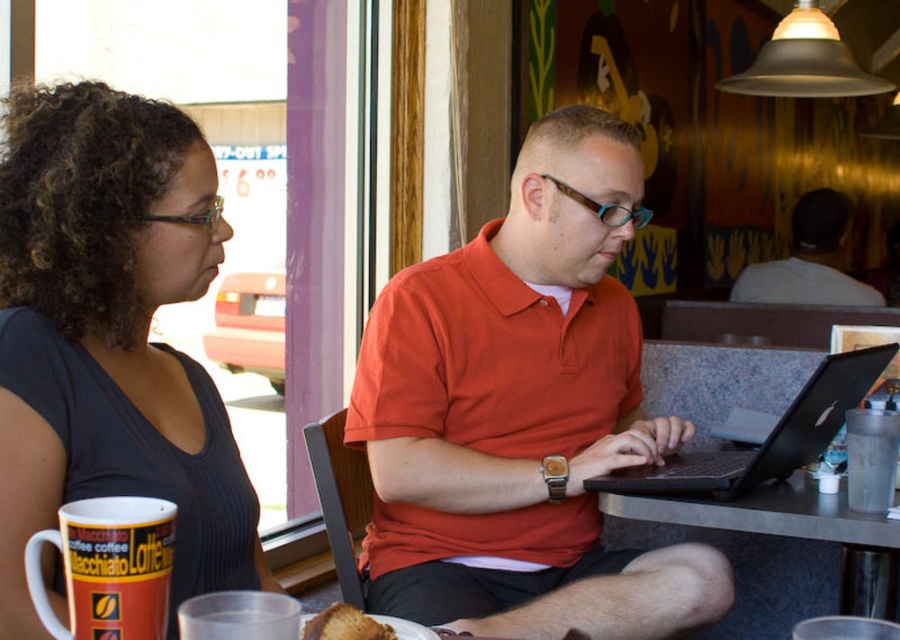
Is black matte laptop at center further to camera compared to white matte shirt at upper right?

No.

Is black matte laptop at center above white matte shirt at upper right?

No.

Which is in front, point (824, 365) or point (731, 292)?

Positioned in front is point (824, 365).

This screenshot has height=640, width=900. I want to click on black matte laptop at center, so click(x=765, y=436).

What do you see at coordinates (111, 333) in the screenshot? I see `dark gray ribbed shirt at left` at bounding box center [111, 333].

Does dark gray ribbed shirt at left come in front of golden brown crumbly pastry at lower center?

No.

Locate an element on the screen. dark gray ribbed shirt at left is located at coordinates (111, 333).

Find the location of `dark gray ribbed shirt at left`. dark gray ribbed shirt at left is located at coordinates (111, 333).

The height and width of the screenshot is (640, 900). In order to click on white matte shirt at upper right in this screenshot , I will do `click(808, 260)`.

Between point (812, 240) and point (356, 612), which one is positioned behind?

The point (812, 240) is behind.

At what (x,y) coordinates should I click in order to perform the action: click on white matte shirt at upper right. Please return your answer as a coordinate pair (x, y). This screenshot has width=900, height=640. Looking at the image, I should click on (808, 260).